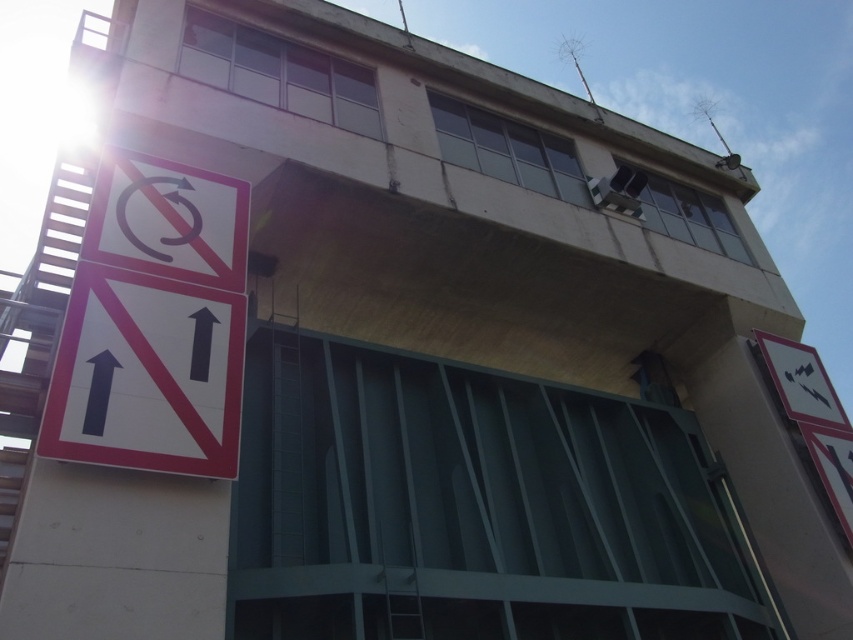
You are a delivery driver approaching the intersection and see the white matte sign at left and the white plastic sign at left. Which one is taller?

The white matte sign at left is taller than the white plastic sign at left.

You are standing at the camera position and want to reach point (62,403). Can you walk directly to it without any obstacles?

The distance between point (62,403) and the camera is 5.98 meters. Since there are no obstacles mentioned in the scene description, you can walk directly to it.